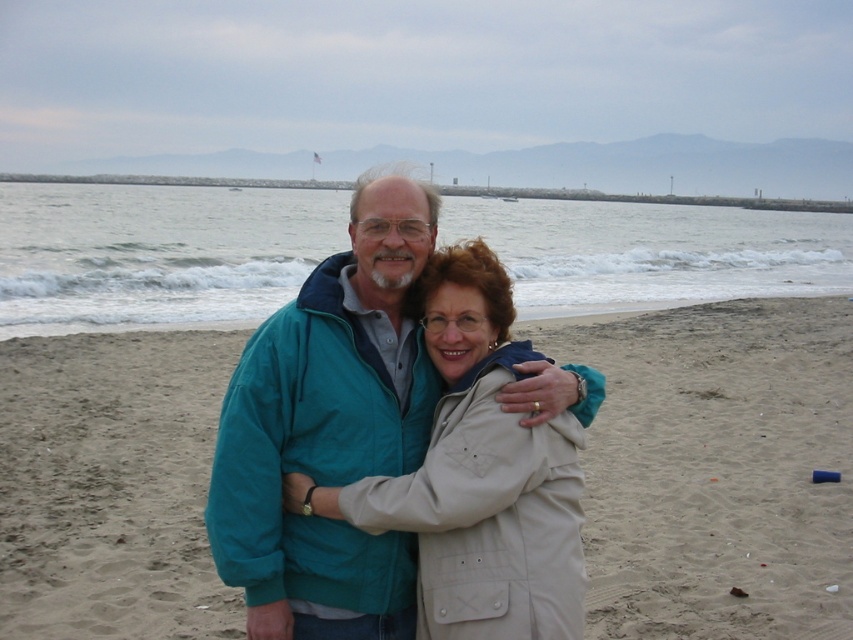
Can you confirm if clear water at center is taller than beige fabric jacket at center?

Indeed, clear water at center has a greater height compared to beige fabric jacket at center.

Is clear water at center positioned at the back of beige fabric jacket at center?

That is True.

Where is `clear water at center`? This screenshot has height=640, width=853. clear water at center is located at coordinates (155, 253).

Which is in front, point (751, 312) or point (245, 224)?

Positioned in front is point (751, 312).

What do you see at coordinates (717, 467) in the screenshot? I see `beige sand at center` at bounding box center [717, 467].

Between point (25, 488) and point (788, 282), which one is positioned in front?

Positioned in front is point (25, 488).

What are the coordinates of `beige sand at center` in the screenshot? It's located at (717, 467).

You are a GUI agent. You are given a task and a screenshot of the screen. Output one action in this format:
    pyautogui.click(x=<x>, y=<y>)
    Task: Click on the beige sand at center
    The image size is (853, 640).
    Given the screenshot: What is the action you would take?
    pyautogui.click(x=717, y=467)

Is beige sand at center thinner than beige fabric jacket at center?

Incorrect, beige sand at center's width is not less than beige fabric jacket at center's.

This screenshot has height=640, width=853. I want to click on beige sand at center, so click(717, 467).